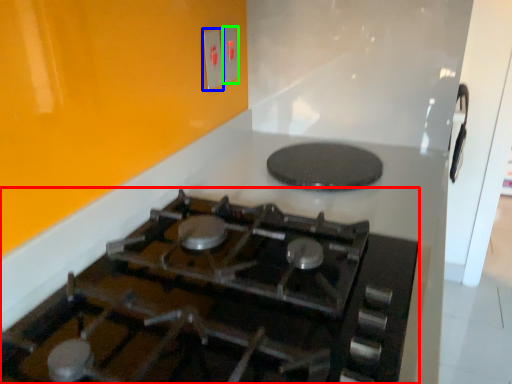
Question: Which object is the closest to the gas stove (highlighted by a red box)? Choose among these: electric outlet (highlighted by a blue box) or electric outlet (highlighted by a green box).

Choices:
 (A) electric outlet
 (B) electric outlet

Answer: (A)